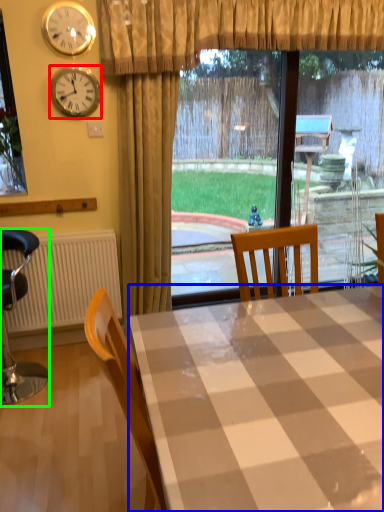
Question: Based on their relative distances, which object is nearer to clock (highlighted by a red box)? Choose from desk (highlighted by a blue box) and chair (highlighted by a green box).

Choices:
 (A) desk
 (B) chair

Answer: (B)